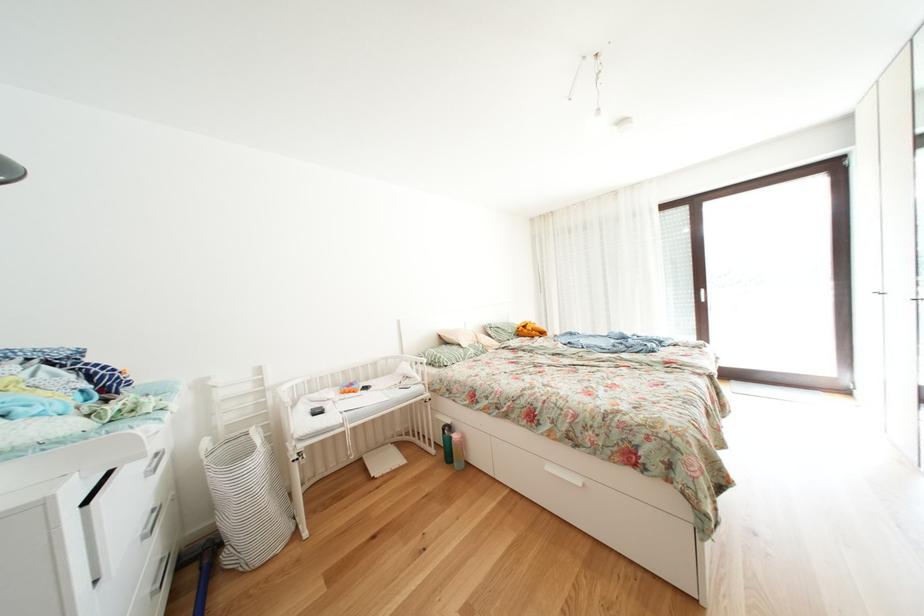
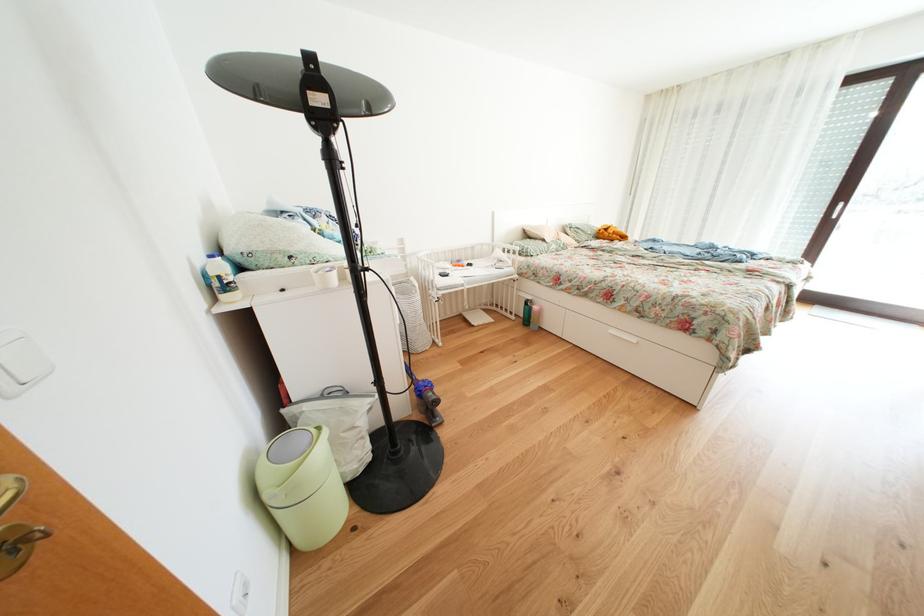
Where in the second image is the point corresponding to pixel 443 456 from the first image?

(523, 323)